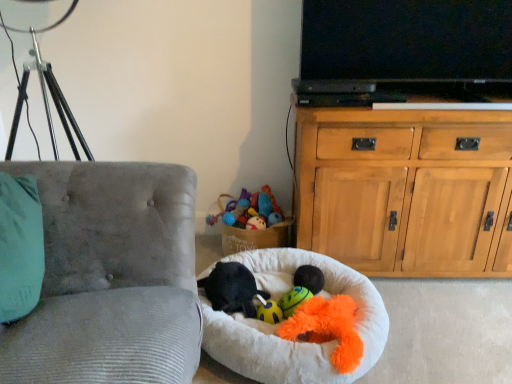
Question: Is black plush toy at center, which is counted as the 1th animal, starting from the right, smaller than white fluffy dog bed at center?

Choices:
 (A) no
 (B) yes

Answer: (B)

Question: Would you say black plush toy at center, placed as the 2th animal when sorted from left to right, is outside white fluffy dog bed at center?

Choices:
 (A) no
 (B) yes

Answer: (A)

Question: Is black plush toy at center, which is counted as the 1th animal, starting from the right, oriented away from white fluffy dog bed at center?

Choices:
 (A) yes
 (B) no

Answer: (A)

Question: From a real-world perspective, is black plush toy at center, which is counted as the 1th animal, starting from the right, beneath white fluffy dog bed at center?

Choices:
 (A) yes
 (B) no

Answer: (B)

Question: Can you confirm if black plush toy at center, placed as the 2th animal when sorted from left to right, is wider than white fluffy dog bed at center?

Choices:
 (A) yes
 (B) no

Answer: (B)

Question: Does black plush toy at center, placed as the 2th animal when sorted from left to right, come behind white fluffy dog bed at center?

Choices:
 (A) yes
 (B) no

Answer: (A)

Question: Is black plush dog bed at lower center, which is the first animal in left-to-right order, at the left side of velvet gray chair at left?

Choices:
 (A) yes
 (B) no

Answer: (B)

Question: From the image's perspective, is black plush dog bed at lower center, placed as the second animal when sorted from right to left, located above velvet gray chair at left?

Choices:
 (A) yes
 (B) no

Answer: (B)

Question: Can you confirm if black plush dog bed at lower center, which is the first animal in left-to-right order, is thinner than velvet gray chair at left?

Choices:
 (A) yes
 (B) no

Answer: (A)

Question: Can you confirm if black plush dog bed at lower center, which is the first animal in left-to-right order, is smaller than velvet gray chair at left?

Choices:
 (A) yes
 (B) no

Answer: (A)

Question: Is black plush dog bed at lower center, which is the first animal in left-to-right order, taller than velvet gray chair at left?

Choices:
 (A) no
 (B) yes

Answer: (A)

Question: Does black plush dog bed at lower center, which is the first animal in left-to-right order, turn towards velvet gray chair at left?

Choices:
 (A) yes
 (B) no

Answer: (B)

Question: From a real-world perspective, is fluffy orange plush toy at center, which is the first toy in front-to-back order, below black plush toy at center, placed as the 2th animal when sorted from left to right?

Choices:
 (A) yes
 (B) no

Answer: (B)